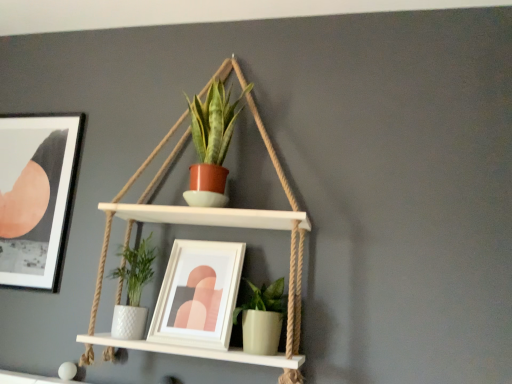
Question: Is matte black picture frame at upper left, which ranks as the 1th picture frame in left-to-right order, positioned with its back to white matte picture frame at center, which is counted as the 1th picture frame, starting from the front?

Choices:
 (A) no
 (B) yes

Answer: (A)

Question: Does matte black picture frame at upper left, which is the 2th picture frame in right-to-left order, have a lesser width compared to white matte picture frame at center, which is counted as the first picture frame, starting from the right?

Choices:
 (A) no
 (B) yes

Answer: (B)

Question: Considering the relative sizes of matte black picture frame at upper left, which is the 2th picture frame in right-to-left order, and white matte picture frame at center, which is counted as the 1th picture frame, starting from the front, in the image provided, is matte black picture frame at upper left, which is the 2th picture frame in right-to-left order, smaller than white matte picture frame at center, which is counted as the 1th picture frame, starting from the front,?

Choices:
 (A) yes
 (B) no

Answer: (A)

Question: Considering the relative sizes of matte black picture frame at upper left, which ranks as the 1th picture frame in left-to-right order, and white matte picture frame at center, which is counted as the 1th picture frame, starting from the front, in the image provided, is matte black picture frame at upper left, which ranks as the 1th picture frame in left-to-right order, bigger than white matte picture frame at center, which is counted as the 1th picture frame, starting from the front,?

Choices:
 (A) yes
 (B) no

Answer: (B)

Question: Considering the relative positions of matte black picture frame at upper left, acting as the 1th picture frame starting from the back, and white matte picture frame at center, the second picture frame from the left, in the image provided, is matte black picture frame at upper left, acting as the 1th picture frame starting from the back, in front of white matte picture frame at center, the second picture frame from the left,?

Choices:
 (A) yes
 (B) no

Answer: (B)

Question: Can you confirm if matte black picture frame at upper left, acting as the 1th picture frame starting from the back, is positioned to the left of white matte picture frame at center, the second picture frame from the left?

Choices:
 (A) no
 (B) yes

Answer: (B)

Question: Can you confirm if green matte pot at lower center, the second houseplant viewed from the top, is shorter than white matte picture frame at center, which is counted as the first picture frame, starting from the right?

Choices:
 (A) no
 (B) yes

Answer: (B)

Question: Is green matte pot at lower center, which ranks as the 1th houseplant in bottom-to-top order, to the left of white matte picture frame at center, the second picture frame from the left, from the viewer's perspective?

Choices:
 (A) yes
 (B) no

Answer: (B)

Question: Is green matte pot at lower center, which ranks as the 1th houseplant in bottom-to-top order, not inside white matte picture frame at center, marked as the second picture frame in a back-to-front arrangement?

Choices:
 (A) no
 (B) yes

Answer: (B)

Question: From the image's perspective, is green matte pot at lower center, which ranks as the 1th houseplant in bottom-to-top order, below white matte picture frame at center, which is counted as the first picture frame, starting from the right?

Choices:
 (A) no
 (B) yes

Answer: (B)

Question: Can you confirm if green matte pot at lower center, which ranks as the 1th houseplant in bottom-to-top order, is thinner than white matte picture frame at center, marked as the second picture frame in a back-to-front arrangement?

Choices:
 (A) yes
 (B) no

Answer: (A)

Question: From a real-world perspective, is green matte pot at lower center, the second houseplant viewed from the top, under white matte picture frame at center, which is counted as the 1th picture frame, starting from the front?

Choices:
 (A) yes
 (B) no

Answer: (A)

Question: Could you tell me if matte terracotta pot at center, placed as the 2th houseplant when sorted from bottom to top, is turned towards green matte pot at lower center, which ranks as the 1th houseplant in bottom-to-top order?

Choices:
 (A) no
 (B) yes

Answer: (A)